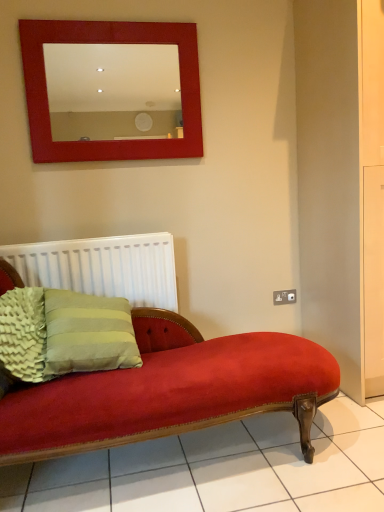
Question: Does satin silver outlet at lower right lie behind white plastic radiator at lower left?

Choices:
 (A) yes
 (B) no

Answer: (A)

Question: Can you confirm if satin silver outlet at lower right is bigger than white plastic radiator at lower left?

Choices:
 (A) no
 (B) yes

Answer: (A)

Question: From the image's perspective, would you say satin silver outlet at lower right is shown under white plastic radiator at lower left?

Choices:
 (A) yes
 (B) no

Answer: (A)

Question: From a real-world perspective, is satin silver outlet at lower right on top of white plastic radiator at lower left?

Choices:
 (A) yes
 (B) no

Answer: (B)

Question: Is satin silver outlet at lower right positioned in front of white plastic radiator at lower left?

Choices:
 (A) no
 (B) yes

Answer: (A)

Question: In terms of height, does white plastic radiator at lower left look taller or shorter compared to green textured pillow at lower left?

Choices:
 (A) short
 (B) tall

Answer: (B)

Question: Is white plastic radiator at lower left in front of or behind green textured pillow at lower left in the image?

Choices:
 (A) front
 (B) behind

Answer: (B)

Question: From the image's perspective, is white plastic radiator at lower left positioned above or below green textured pillow at lower left?

Choices:
 (A) below
 (B) above

Answer: (B)

Question: Choose the correct answer: Is white plastic radiator at lower left inside green textured pillow at lower left or outside it?

Choices:
 (A) inside
 (B) outside

Answer: (B)

Question: From a real-world perspective, is green textured pillow at lower left physically located above or below satin silver outlet at lower right?

Choices:
 (A) above
 (B) below

Answer: (A)

Question: Is point (11, 300) positioned closer to the camera than point (286, 298)?

Choices:
 (A) closer
 (B) farther

Answer: (A)

Question: Considering their positions, is green textured pillow at lower left located in front of or behind satin silver outlet at lower right?

Choices:
 (A) behind
 (B) front

Answer: (B)

Question: Looking at the image, does green textured pillow at lower left seem bigger or smaller compared to satin silver outlet at lower right?

Choices:
 (A) big
 (B) small

Answer: (A)

Question: Relative to white plastic radiator at lower left, is green textured pillow at lower left in front or behind?

Choices:
 (A) front
 (B) behind

Answer: (A)

Question: Is green textured pillow at lower left wider or thinner than white plastic radiator at lower left?

Choices:
 (A) thin
 (B) wide

Answer: (B)